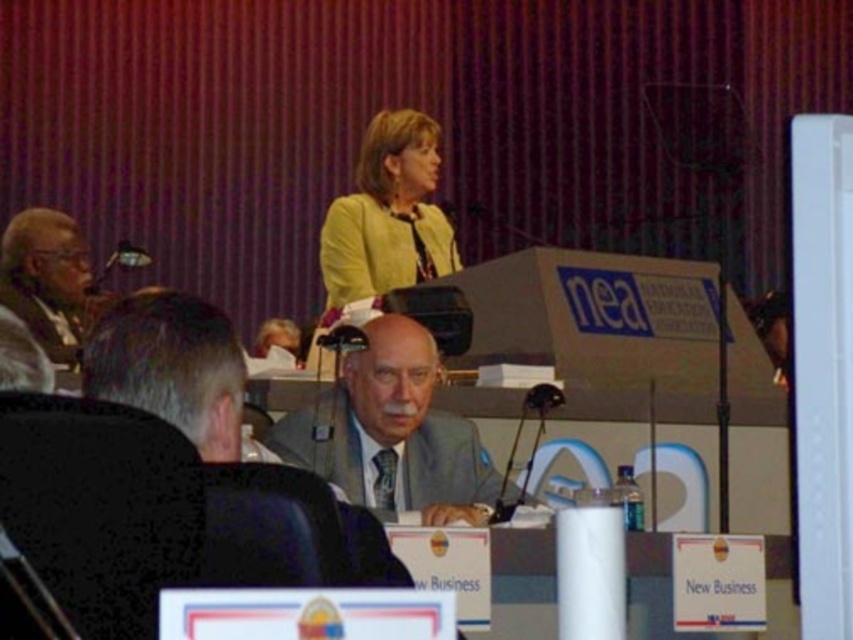
You are an event organizer and need to ensure that the matte yellow jacket at center and the matte black microphone at left are visible to all attendees. Given their sizes, which object might block the view of the other?

The matte yellow jacket at center is much taller than the matte black microphone at left, so it might block the view of the matte black microphone at left.

You are an attendee at this conference and you want to determine which of the two points, point (x=444, y=506) or point (x=425, y=141), is closer to you. Based on the scene, which point is closer?

Point (x=444, y=506) is closer to the viewer than point (x=425, y=141).

You are standing in the conference room and want to know how far the point at coordinates (428,349) is from your position. Can you determine the distance?

The distance of point (428,349) from the camera is 4.86 meters, so the point is 4.86 meters away from your current position.